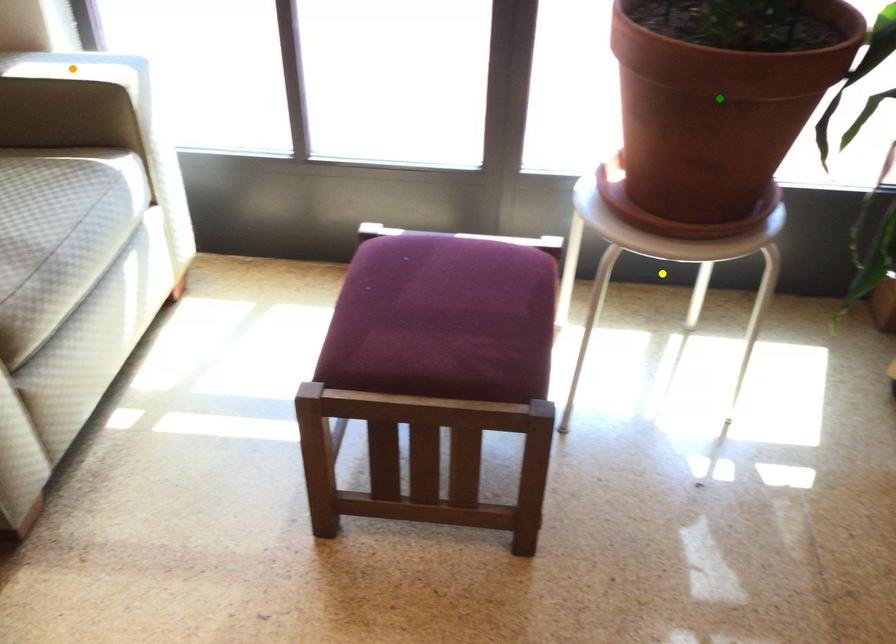
Order these from farthest to nearest:
- green point
- yellow point
- orange point

orange point, yellow point, green point